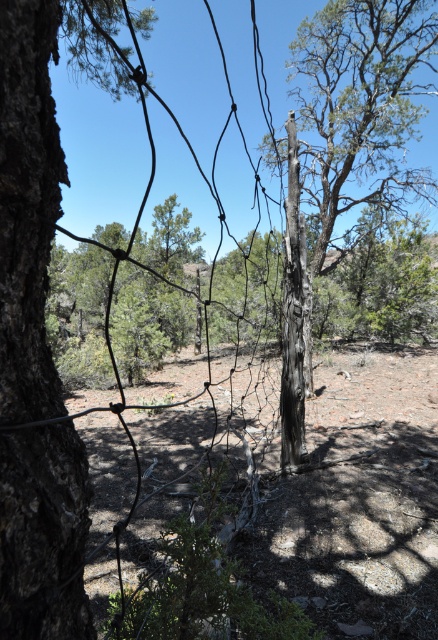
Question: Does dark brown bark tree trunk at left appear on the right side of charred wood tree at center?

Choices:
 (A) yes
 (B) no

Answer: (B)

Question: Estimate the real-world distances between objects in this image. Which object is closer to the charred wood tree at center?

Choices:
 (A) brown dirt field at center
 (B) dark brown bark tree trunk at left
 (C) charcoal textured tree trunk at center

Answer: (A)

Question: Is brown dirt field at center to the right of charred wood tree at center from the viewer's perspective?

Choices:
 (A) yes
 (B) no

Answer: (B)

Question: Can you confirm if charred wood tree at center is wider than charcoal textured tree trunk at center?

Choices:
 (A) yes
 (B) no

Answer: (A)

Question: Among these objects, which one is farthest from the camera?

Choices:
 (A) charcoal textured tree trunk at center
 (B) brown dirt field at center
 (C) charred wood tree at center

Answer: (C)

Question: Which point is closer to the camera?

Choices:
 (A) dark brown bark tree trunk at left
 (B) brown dirt field at center
 (C) charcoal textured tree trunk at center
 (D) charred wood tree at center

Answer: (A)